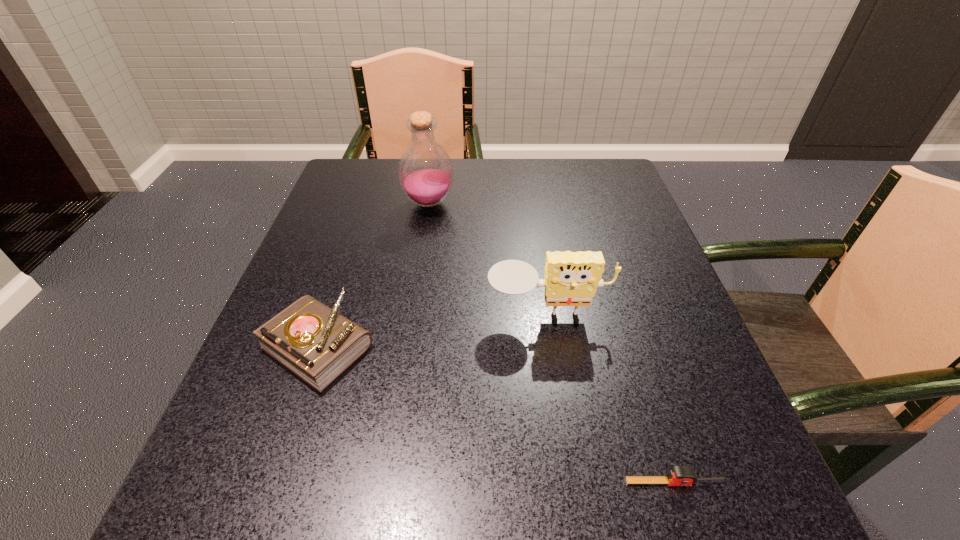
Identify the location of bottle. (425, 171).

Locate an element on the screen. The width and height of the screenshot is (960, 540). the farthest object is located at coordinates [425, 171].

Find the location of a particular element. The width and height of the screenshot is (960, 540). sponge is located at coordinates (571, 278).

Identify the location of diary. This screenshot has height=540, width=960. (315, 342).

Where is `tape measure`? The image size is (960, 540). tape measure is located at coordinates point(678,475).

Identify the location of the shortest object. (678, 475).

You are a GUI agent. You are given a task and a screenshot of the screen. Output one action in this format:
    pyautogui.click(x=<x>, y=<y>)
    Task: Click on the free location located 0.080m on the front of the bottle
    The height and width of the screenshot is (540, 960).
    Given the screenshot: What is the action you would take?
    pyautogui.click(x=423, y=240)

Locate an element on the screen. vacant space located 0.070m on the front-facing side of the second tallest object is located at coordinates (555, 367).

Image resolution: width=960 pixels, height=540 pixels. I want to click on free space located 0.080m on the front of the diary, so tap(285, 442).

The image size is (960, 540). I want to click on vacant space situated on the left of the nearest object, so (343, 482).